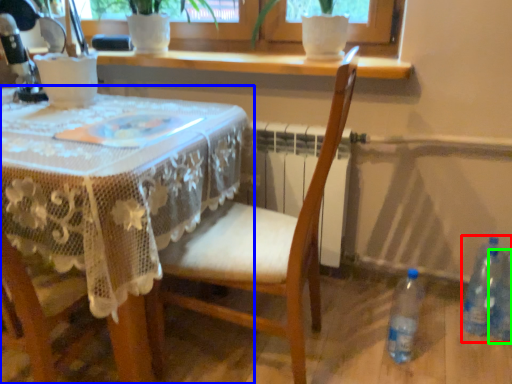
Question: Which is nearer to the bottle (highlighted by a red box)? table (highlighted by a blue box) or bottle (highlighted by a green box).

Choices:
 (A) table
 (B) bottle

Answer: (B)